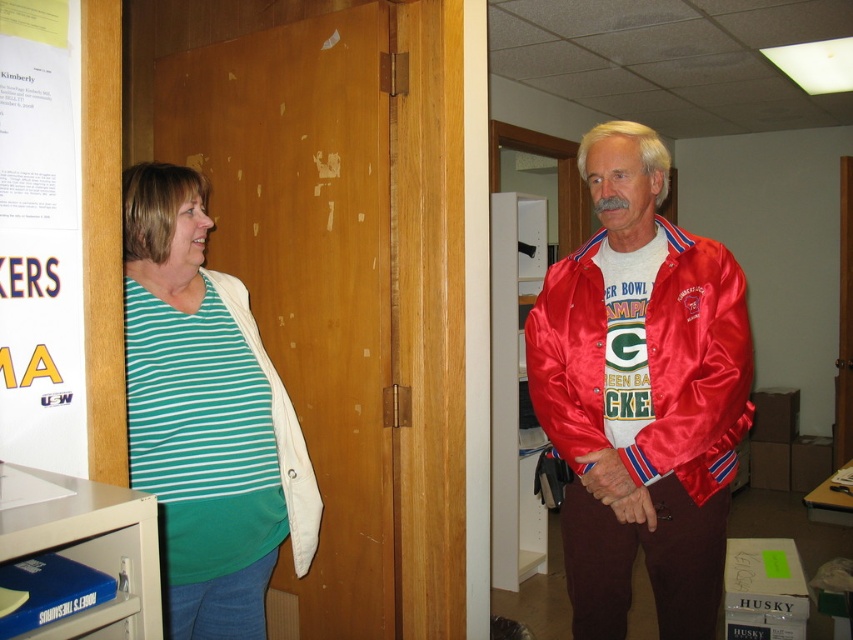
In the scene shown: You are standing at the camera position and want to reach point (572, 355). Can you walk directly to it if you need to cover 1.87 meters?

Yes, you can walk directly to point (572, 355) since the distance is 1.87 meters, which is within a normal walking range.

You are organizing a poster for an event and need to hang it on the green matte bulletin board at left or the satin red jacket at right. Which object is located to the left side of the other?

The green matte bulletin board at left is positioned on the left side of the satin red jacket at right.

You are organizing a community event and need to hang a new poster. You have two options on the left wall, the green matte bulletin board at left and the white paper poster at left. Which one has a larger width to accommodate a bigger announcement?

The green matte bulletin board at left has a larger width than the white paper poster at left, so it can accommodate a bigger announcement.